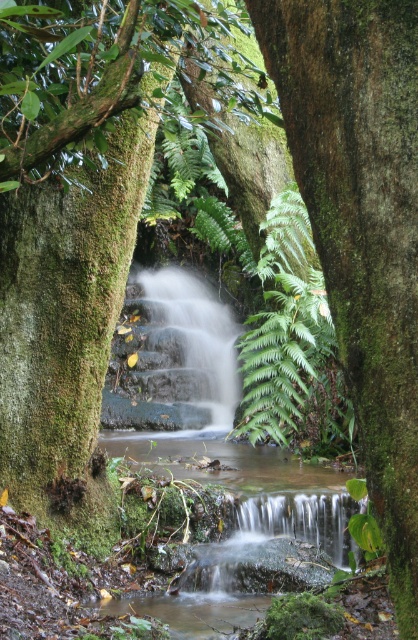
You are a botanist examining the green mossy tree trunk at center and the green leafy fern at center in the image. Which of these two plants has a wider base?

The green leafy fern at center has a wider base than the green mossy tree trunk at center.

You are a hiker standing at the edge of the waterfall. You notice a green mossy tree trunk at center and a green leafy fern at center. Which object is positioned to the left of the other?

The green mossy tree trunk at center is to the left of green leafy fern at center.